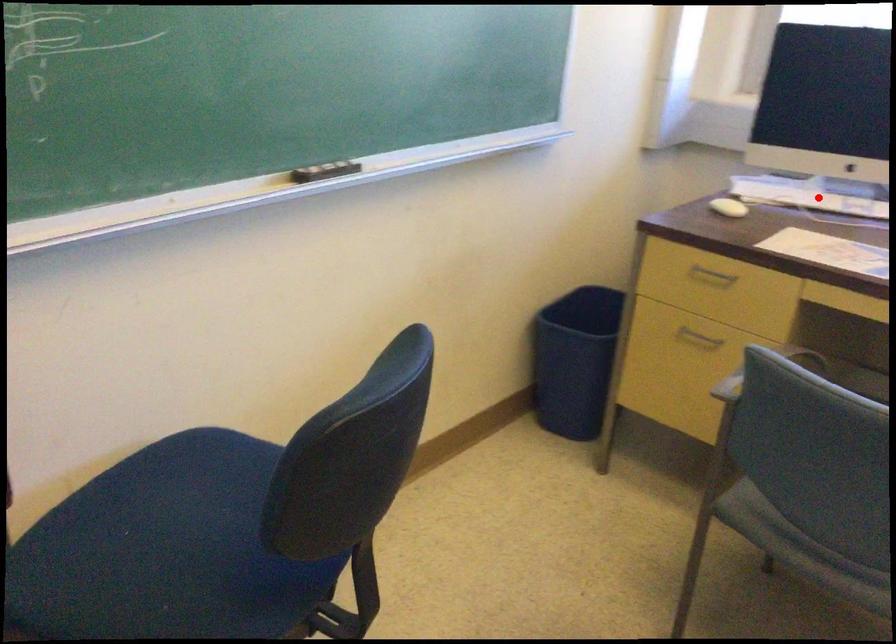
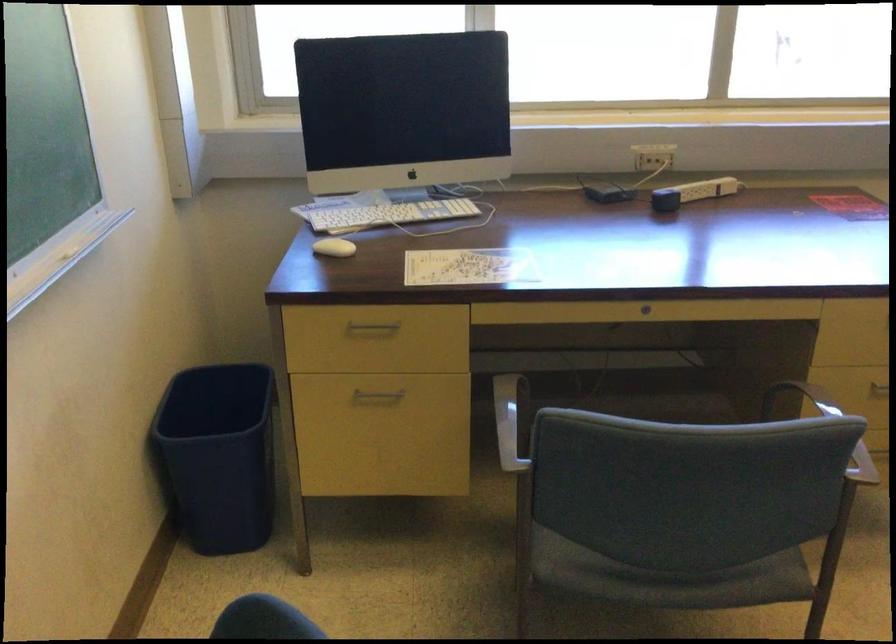
In the second image, find the point that corresponds to the highlighted location in the first image.

(389, 214)